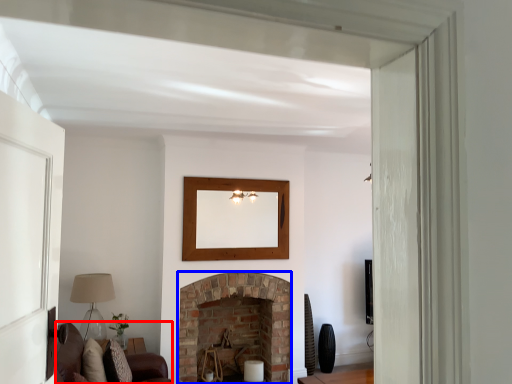
Question: Which of the following is the farthest to the observer, couch (highlighted by a red box) or fireplace (highlighted by a blue box)?

Choices:
 (A) couch
 (B) fireplace

Answer: (B)